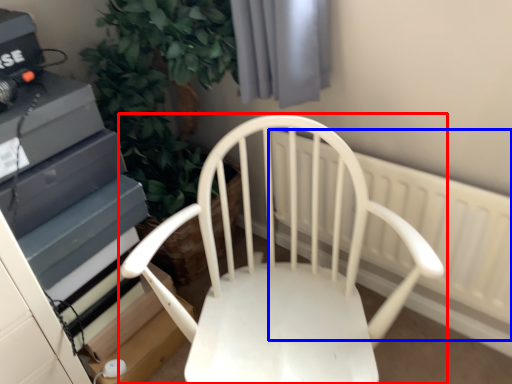
Question: Which object is further to the camera taking this photo, chair (highlighted by a red box) or radiator (highlighted by a blue box)?

Choices:
 (A) chair
 (B) radiator

Answer: (B)